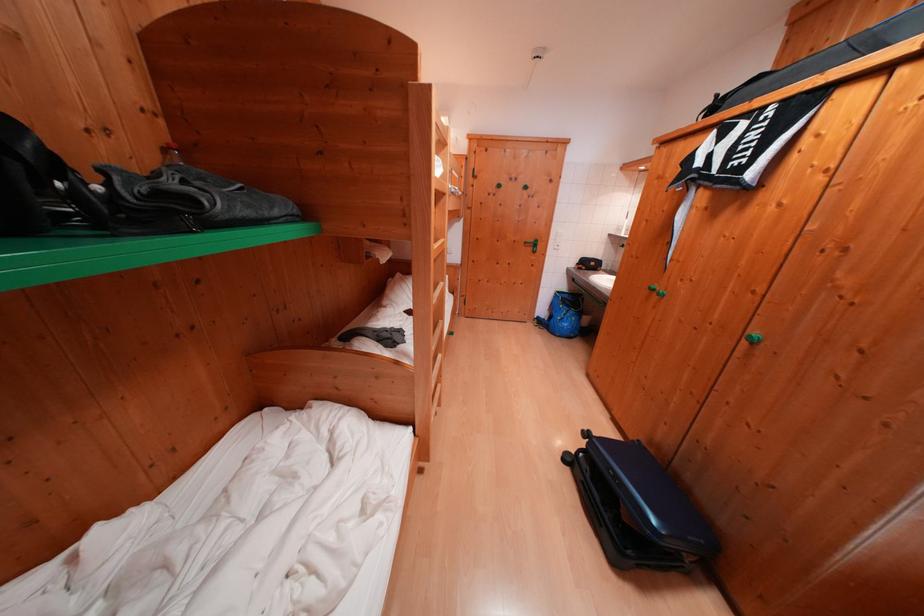
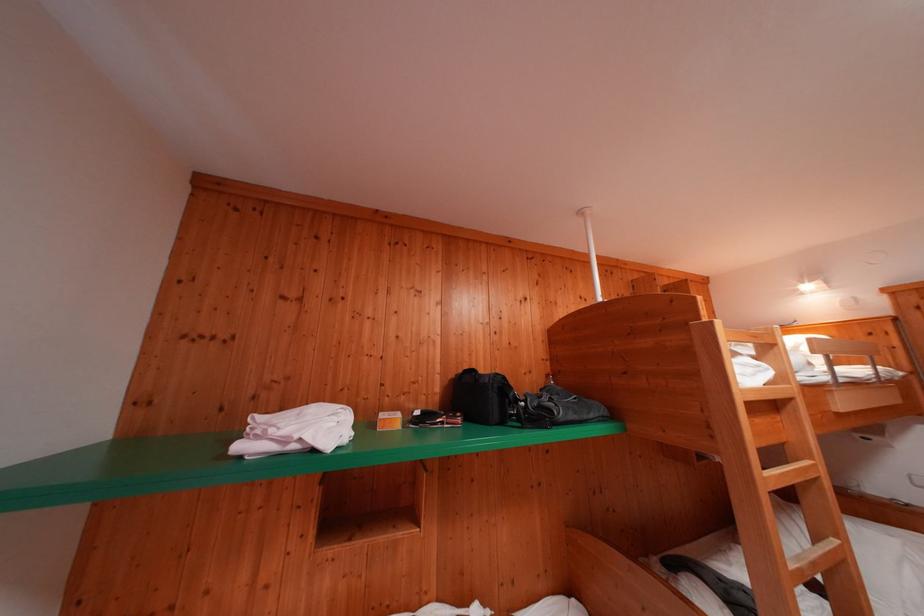
The point at (450, 288) is marked in the first image. Where is the corresponding point in the second image?

(843, 545)